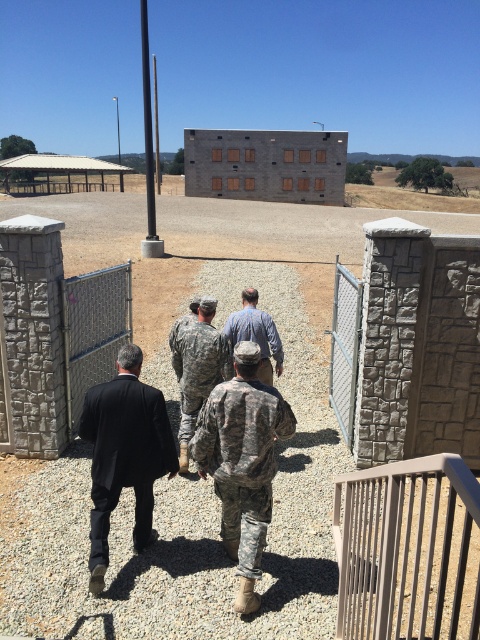
You are a delivery person trying to pass through the area between the wire mesh fence at center and the denim shirt at center. Based on the scene description, can you fit through the space between them?

The wire mesh fence at center is narrower than the denim shirt at center. Since the fence is narrower, the space between them might be too tight for a delivery person to pass through comfortably. However, without knowing the exact width of the delivery person or the distance between them, it is difficult to determine definitively.

You are a security guard observing the scene. You notice the wire mesh fence at center and the denim shirt at center. Which object is positioned higher from the ground?

The wire mesh fence at center is located above the denim shirt at center, so the wire mesh fence at center is higher from the ground.

You are a photographer standing at the camera position. You want to take a photo of the scene but need to ensure the brown metal fence at lower right is not in the foreground. What should you do?

The brown metal fence at lower right is 1.51 meters away from the camera. To avoid having it in the foreground, you should move back so that the distance between you and the fence exceeds 1.51 meters.